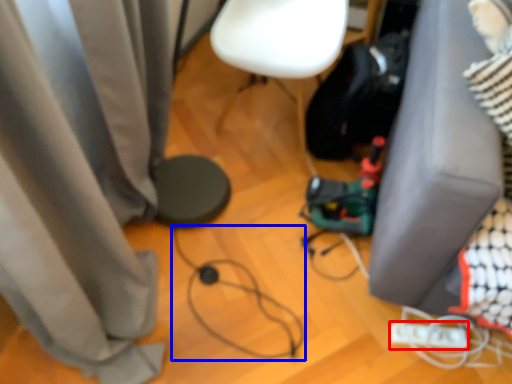
Question: Which of the following is the closest to the observer, Wii controller (highlighted by a red box) or wire (highlighted by a blue box)?

Choices:
 (A) Wii controller
 (B) wire

Answer: (B)